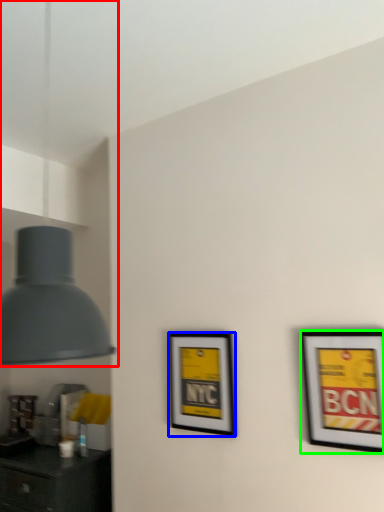
Question: Estimate the real-world distances between objects in this image. Which object is farther from lamp (highlighted by a red box), picture frame (highlighted by a blue box) or picture frame (highlighted by a green box)?

Choices:
 (A) picture frame
 (B) picture frame

Answer: (A)